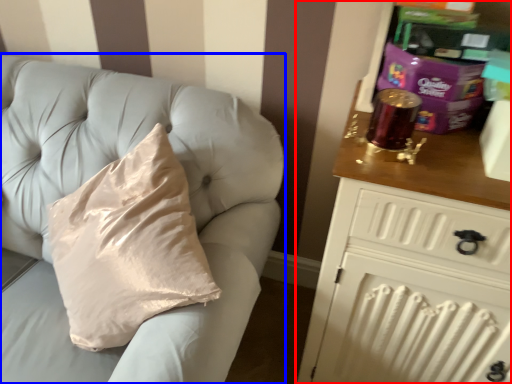
Question: Among these objects, which one is nearest to the camera, chest of drawers (highlighted by a red box) or furniture (highlighted by a blue box)?

Choices:
 (A) chest of drawers
 (B) furniture

Answer: (A)